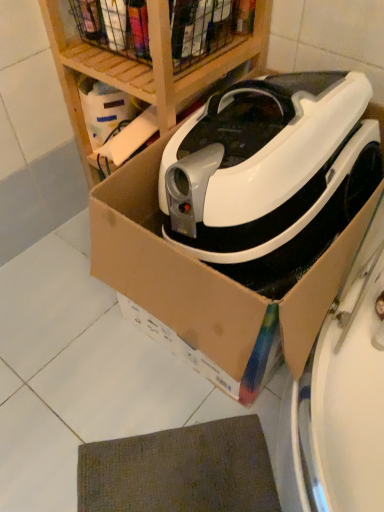
Question: From the image's perspective, is wooden at upper center positioned above or below white glossy robotic vacuum cleaner at center?

Choices:
 (A) below
 (B) above

Answer: (B)

Question: From a real-world perspective, is wooden at upper center positioned above or below white glossy robotic vacuum cleaner at center?

Choices:
 (A) below
 (B) above

Answer: (A)

Question: Considering the real-world distances, which object is closest to the brown textured mat at lower center?

Choices:
 (A) white glossy robotic vacuum cleaner at center
 (B) wooden at upper center
 (C) cardboard box at center

Answer: (C)

Question: Which is farther from the cardboard box at center?

Choices:
 (A) brown textured mat at lower center
 (B) white glossy robotic vacuum cleaner at center
 (C) wooden at upper center

Answer: (C)